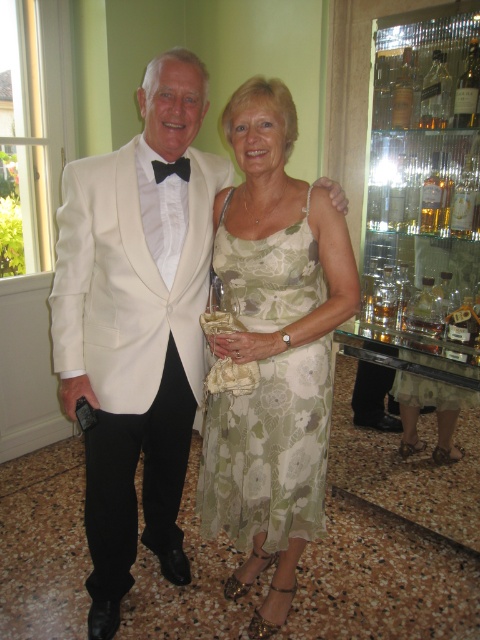
Where is `white satin tuxedo at center`? This screenshot has width=480, height=640. white satin tuxedo at center is located at coordinates (136, 323).

Is white satin tuxedo at center positioned before green floral fabric dress at center?

Yes, it is.

The height and width of the screenshot is (640, 480). I want to click on white satin tuxedo at center, so click(136, 323).